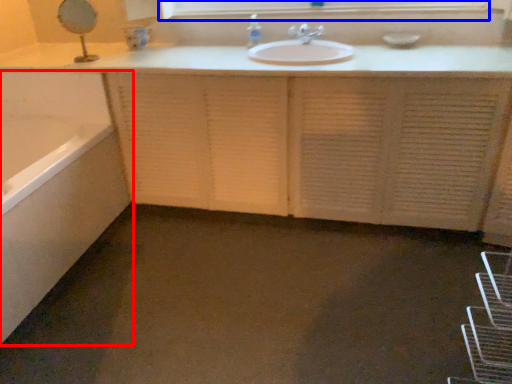
Question: Which of the following is the closest to the observer, bathtub (highlighted by a red box) or medicine cabinet (highlighted by a blue box)?

Choices:
 (A) bathtub
 (B) medicine cabinet

Answer: (A)